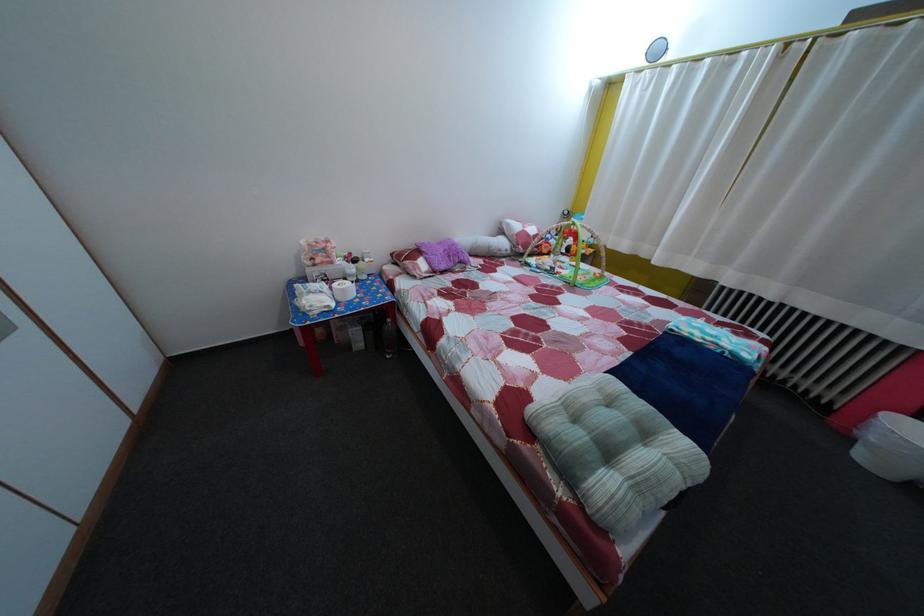
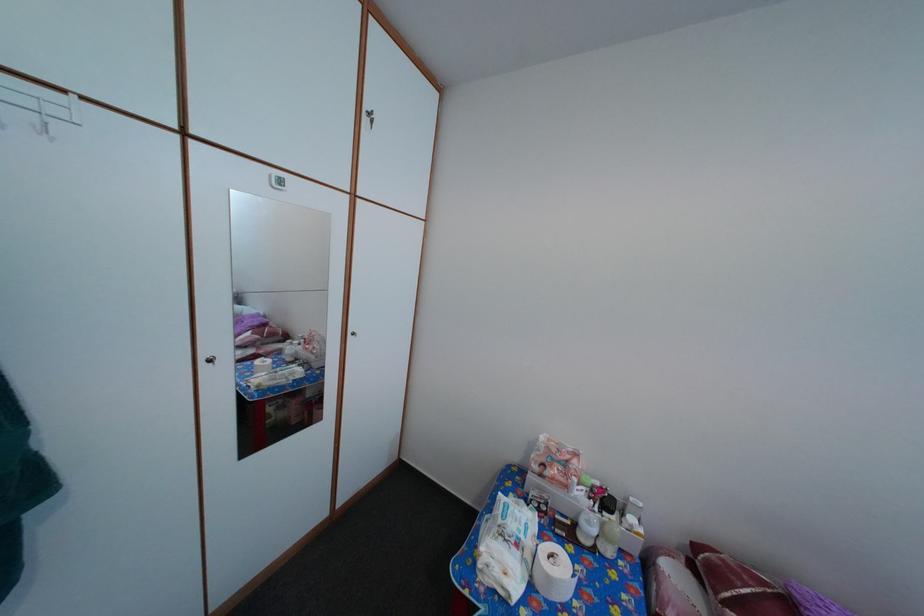
Where in the second image is the point corresponding to [334,257] from the first image?

(576, 469)